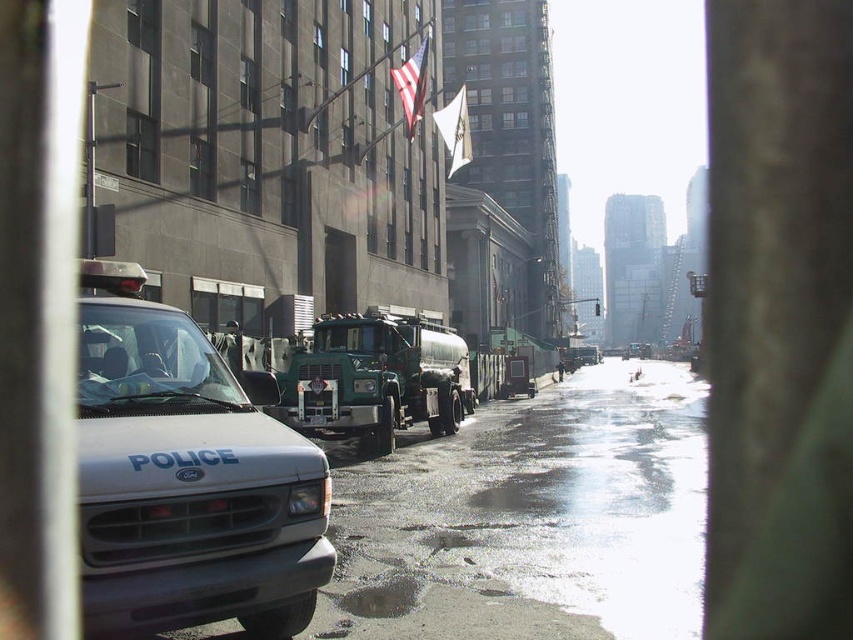
You are a delivery driver who needs to pass through a narrow alleyway. You see the white matte police van at left and the green matte tanker truck at center in your path. Which vehicle should you avoid because it is taller and might block the passage?

The green matte tanker truck at center is taller than the white matte police van at left, so you should avoid it as it might block the passage due to its height.

You are a delivery driver who needs to pass through the narrow opening between the white matte police van at left and the green matte tanker truck at center. Can you safely navigate through this space?

The white matte police van at left is positioned on the left side of the green matte tanker truck at center, so there is space between them for the delivery driver to pass through the narrow opening safely.